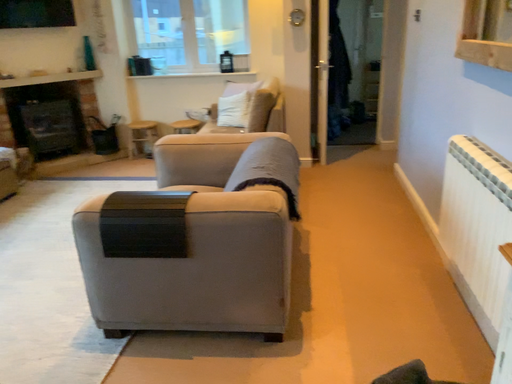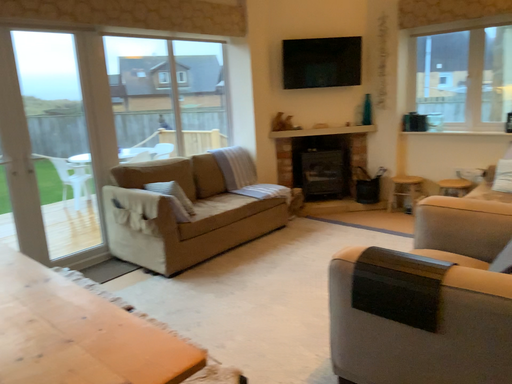
Question: Which way did the camera rotate in the video?

Choices:
 (A) rotated right
 (B) rotated left

Answer: (B)